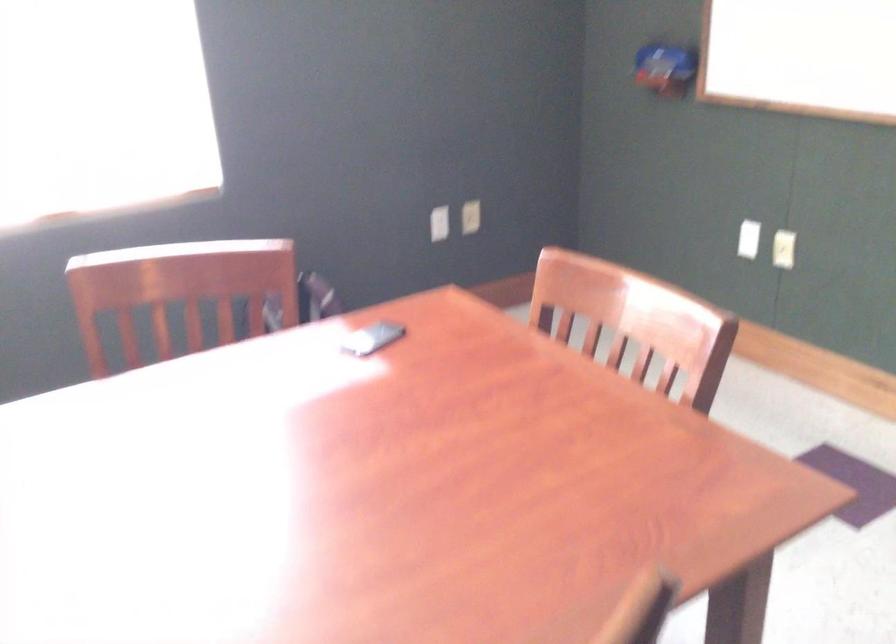
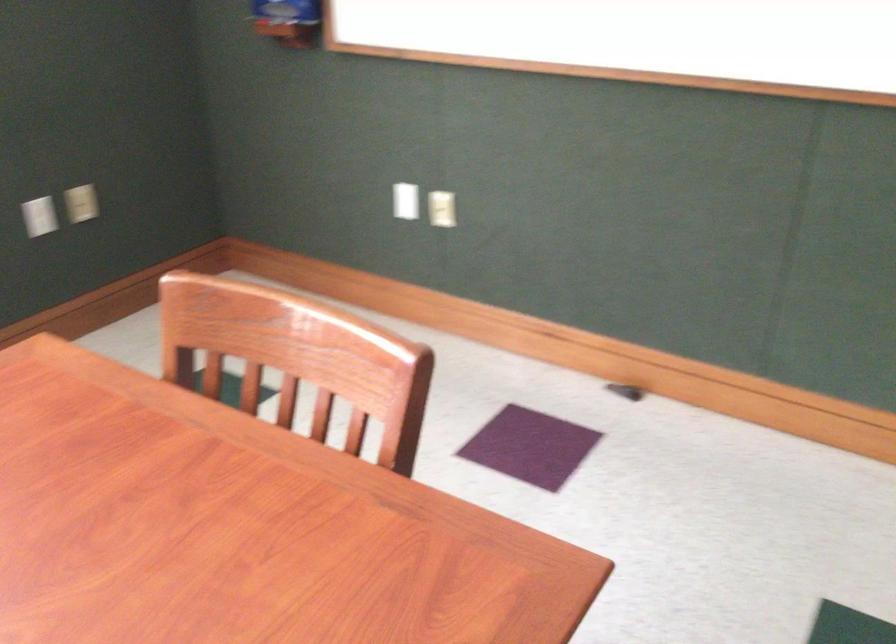
Question: The camera is either moving clockwise (left) or counter-clockwise (right) around the object. The first image is from the beginning of the video and the second image is from the end. Is the camera moving left or right when shooting the video?

Choices:
 (A) Left
 (B) Right

Answer: (A)